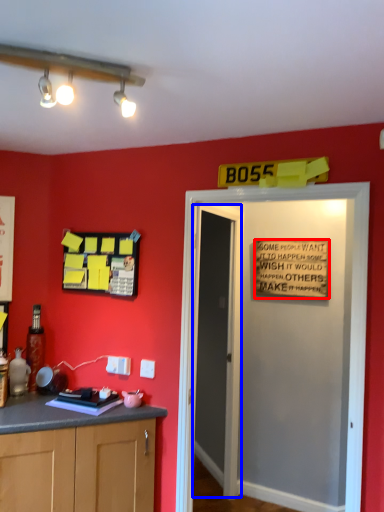
Question: Which point is further to the camera, warning sign (highlighted by a red box) or door (highlighted by a blue box)?

Choices:
 (A) warning sign
 (B) door

Answer: (A)